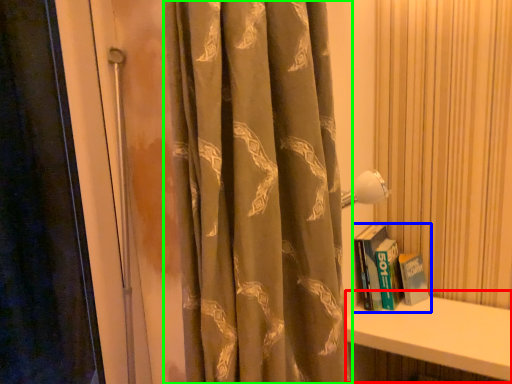
Question: Which object is positioned closest to window sill (highlighted by a red box)? Select from book (highlighted by a blue box) and curtain (highlighted by a green box).

Choices:
 (A) book
 (B) curtain

Answer: (A)